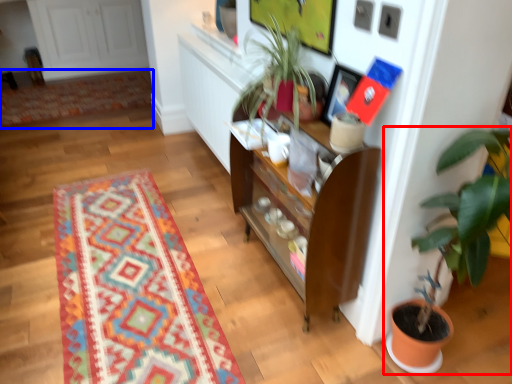
Question: Which object is closer to the camera taking this photo, houseplant (highlighted by a red box) or mat (highlighted by a blue box)?

Choices:
 (A) houseplant
 (B) mat

Answer: (A)